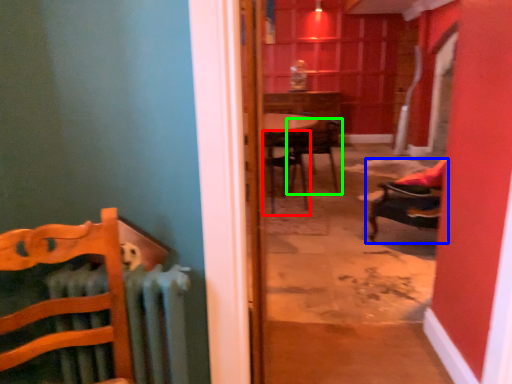
Question: Estimate the real-world distances between objects in this image. Which object is closer to chair (highlighted by a red box), chair (highlighted by a blue box) or chair (highlighted by a green box)?

Choices:
 (A) chair
 (B) chair

Answer: (B)